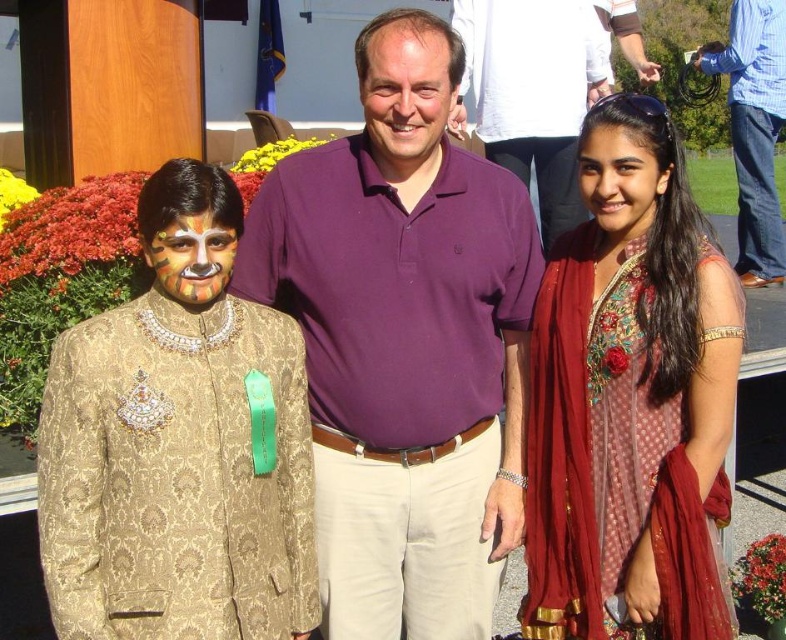
Looking at the two faces in the scene, which one has a larger area? The smooth skin face at center or the matte gold face paint at center?

The smooth skin face at center is bigger than the matte gold face paint at center, so the smooth skin face at center has a larger area.

You are a photographer trying to capture a closeup of the purple cotton shirt at center and the matte gold face paint at center. Which object should you focus on first if you want to ensure both are in focus?

The purple cotton shirt at center has a larger size compared to matte gold face paint at center, so you should focus on the purple cotton shirt at center first to ensure both are in focus.